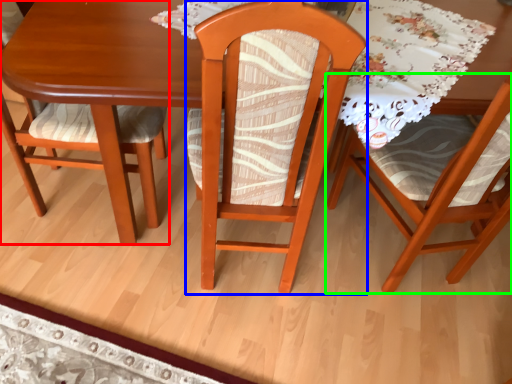
Question: Estimate the real-world distances between objects in this image. Which object is closer to chair (highlighted by a red box), chair (highlighted by a blue box) or chair (highlighted by a green box)?

Choices:
 (A) chair
 (B) chair

Answer: (A)